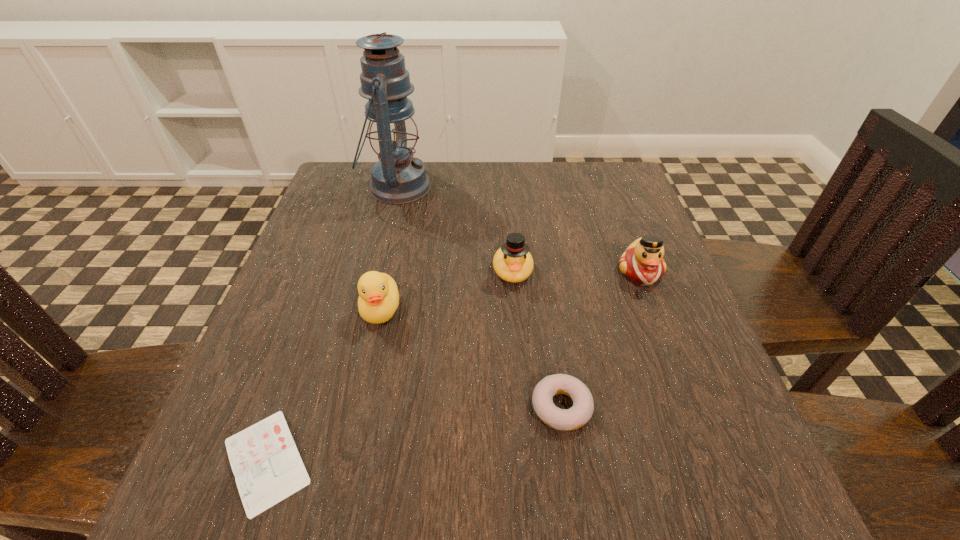
Where is `vacant region at the far edge of the desktop`? The image size is (960, 540). vacant region at the far edge of the desktop is located at coordinates (532, 177).

Where is `vacant space at the left edge of the desktop`? vacant space at the left edge of the desktop is located at coordinates click(336, 288).

Locate an element on the screen. vacant space at the right edge of the desktop is located at coordinates (632, 232).

This screenshot has width=960, height=540. I want to click on free space at the far left corner of the desktop, so click(x=363, y=163).

You are a GUI agent. You are given a task and a screenshot of the screen. Output one action in this format:
    pyautogui.click(x=<x>, y=<y>)
    Task: Click on the vacant space at the far right corner of the desktop
    
    Given the screenshot: What is the action you would take?
    pyautogui.click(x=566, y=176)

I want to click on free spot between the second shortest object and the second duck from left to right, so click(x=537, y=339).

Identify the location of empty location between the leftmost duck and the rightmost object. 511,291.

You are a GUI agent. You are given a task and a screenshot of the screen. Output one action in this format:
    pyautogui.click(x=<x>, y=<y>)
    Task: Click on the free space between the leftmost duck and the doughnut
    This screenshot has width=960, height=540.
    Given the screenshot: What is the action you would take?
    pyautogui.click(x=471, y=358)

At what (x,y) coordinates should I click in order to perform the action: click on free spot between the rightmost duck and the diary. Please return your answer as a coordinate pair (x, y). Image resolution: width=960 pixels, height=540 pixels. Looking at the image, I should click on (453, 367).

The image size is (960, 540). Identify the location of vacant area that lies between the second duck from right to left and the rightmost duck. (576, 271).